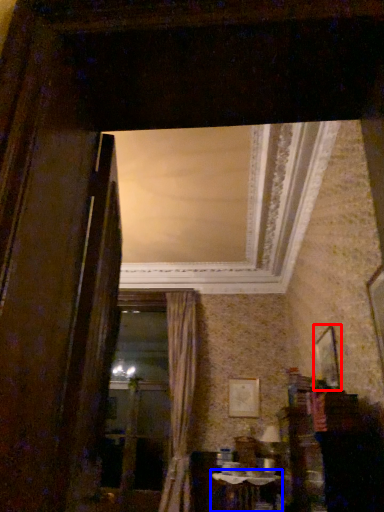
Question: Which object is further to the camera taking this photo, picture frame (highlighted by a red box) or table (highlighted by a blue box)?

Choices:
 (A) picture frame
 (B) table

Answer: (B)